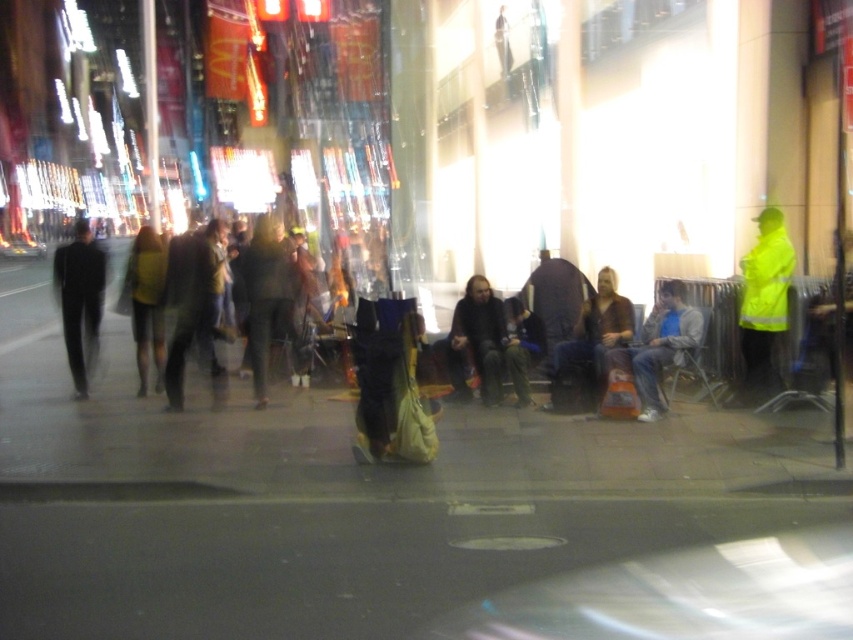
Is point (167, 371) farther from viewer compared to point (59, 296)?

No, it is not.

Between dark gray pants at center and black matte suit at left, which one has more height?

black matte suit at left is taller.

Is point (195, 336) farther from viewer compared to point (77, 342)?

No, it is not.

The height and width of the screenshot is (640, 853). Identify the location of dark gray pants at center. (192, 307).

Does smooth concrete pavement at center appear on the left side of dark gray pants at center?

No, smooth concrete pavement at center is not to the left of dark gray pants at center.

At what (x,y) coordinates should I click in order to perform the action: click on smooth concrete pavement at center. Please return your answer as a coordinate pair (x, y). Image resolution: width=853 pixels, height=640 pixels. Looking at the image, I should click on (383, 513).

Can you confirm if dark gray fabric bag at center is positioned to the right of brown leather jacket at center?

Incorrect, dark gray fabric bag at center is not on the right side of brown leather jacket at center.

Looking at this image, does dark gray fabric bag at center have a lesser width compared to brown leather jacket at center?

Correct, dark gray fabric bag at center's width is less than brown leather jacket at center's.

Is point (254, 332) farther from camera compared to point (549, 404)?

No.

Image resolution: width=853 pixels, height=640 pixels. I want to click on dark gray fabric bag at center, so click(x=265, y=296).